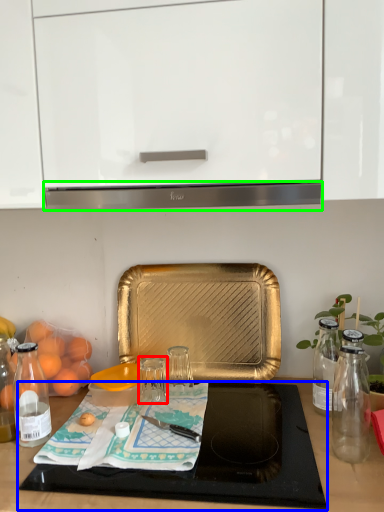
Question: Which object is positioned farthest from glass jar (highlighted by a red box)? Select from cutting board (highlighted by a blue box) and exhaust hood (highlighted by a green box).

Choices:
 (A) cutting board
 (B) exhaust hood

Answer: (B)